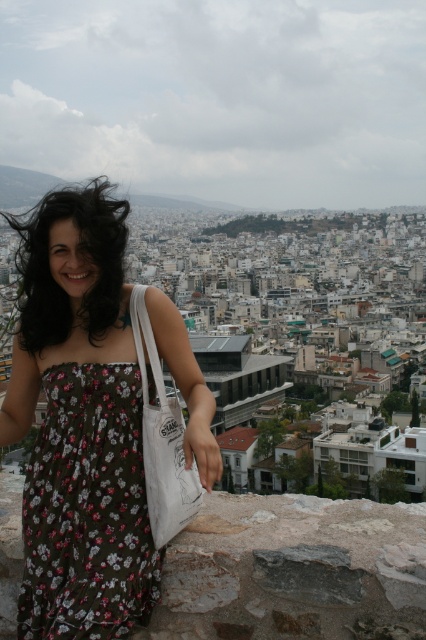
Measure the distance between floral print fabric dress at center and white canvas tote at center.

16.65 feet

You are a GUI agent. You are given a task and a screenshot of the screen. Output one action in this format:
    pyautogui.click(x=<x>, y=<y>)
    Task: Click on the floral print fabric dress at center
    The width and height of the screenshot is (426, 640).
    Given the screenshot: What is the action you would take?
    pyautogui.click(x=88, y=509)

Is point (120, 257) positioned behind point (83, 545)?

Yes, point (120, 257) is farther from viewer.

Does floral cotton dress at center appear on the right side of floral print fabric dress at center?

In fact, floral cotton dress at center is to the left of floral print fabric dress at center.

Locate an element on the screen. The width and height of the screenshot is (426, 640). floral cotton dress at center is located at coordinates (80, 424).

At what (x,y) coordinates should I click in order to perform the action: click on floral cotton dress at center. Please return your answer as a coordinate pair (x, y). The image size is (426, 640). Looking at the image, I should click on (80, 424).

Does point (83, 214) come behind point (144, 472)?

Yes.

Is dark brown silky hair at left to the right of white canvas tote at center from the viewer's perspective?

In fact, dark brown silky hair at left is to the left of white canvas tote at center.

Find the location of a particular element. dark brown silky hair at left is located at coordinates (83, 252).

At what (x,y) coordinates should I click in order to perform the action: click on dark brown silky hair at left. Please return your answer as a coordinate pair (x, y). The height and width of the screenshot is (640, 426). Looking at the image, I should click on (83, 252).